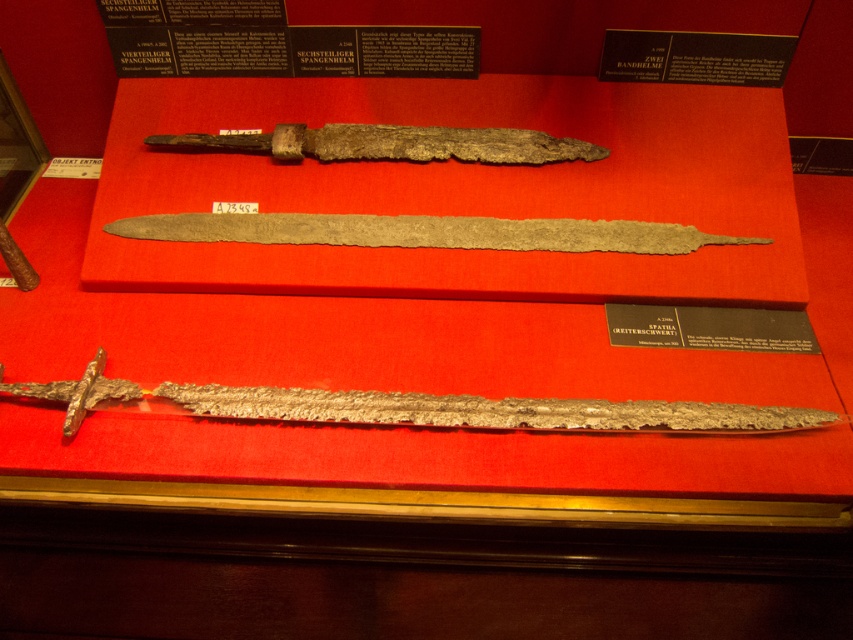
From the picture: Which is below, rusty metal dagger at center or rusty metal sword at center?

Positioned lower is rusty metal dagger at center.

Measure the distance between point [119,396] and camera.

Point [119,396] and camera are 1.38 meters apart from each other.

The width and height of the screenshot is (853, 640). In order to click on rusty metal dagger at center in this screenshot , I will do tap(416, 406).

Does silver metallic dagger at center lie in front of rusty metal sword at center?

Yes, it is.

Can you confirm if silver metallic dagger at center is positioned to the right of rusty metal sword at center?

Correct, you'll find silver metallic dagger at center to the right of rusty metal sword at center.

Is point (364, 225) in front of point (428, 156)?

Yes, point (364, 225) is in front of point (428, 156).

Find the location of a particular element. silver metallic dagger at center is located at coordinates (424, 230).

In the scene shown: Is rusty metal dagger at center positioned in front of silver metallic dagger at center?

Yes, it is.

Who is shorter, rusty metal dagger at center or silver metallic dagger at center?

silver metallic dagger at center

Measure the distance between point (245, 413) and camera.

A distance of 1.36 meters exists between point (245, 413) and camera.

Image resolution: width=853 pixels, height=640 pixels. Find the location of `rusty metal dagger at center`. rusty metal dagger at center is located at coordinates (416, 406).